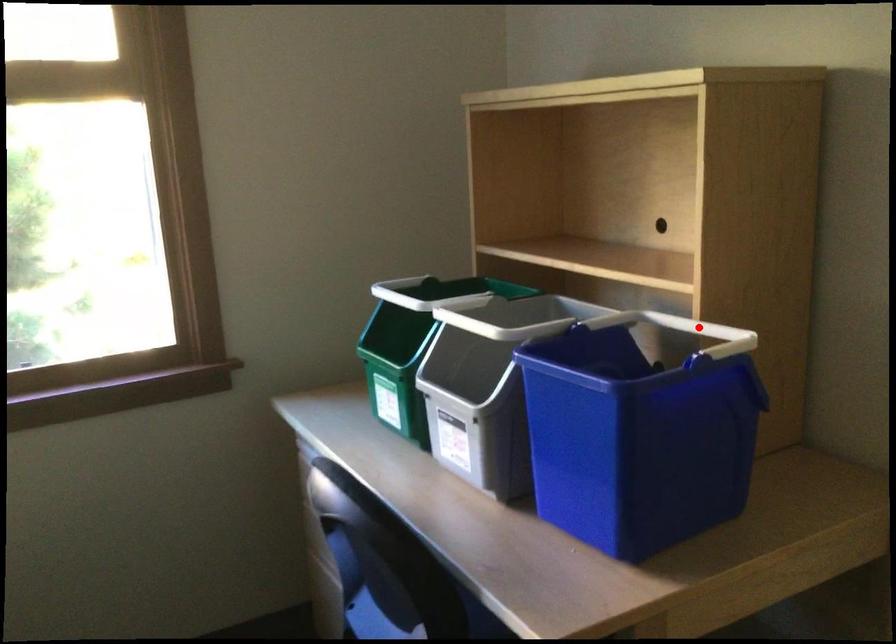
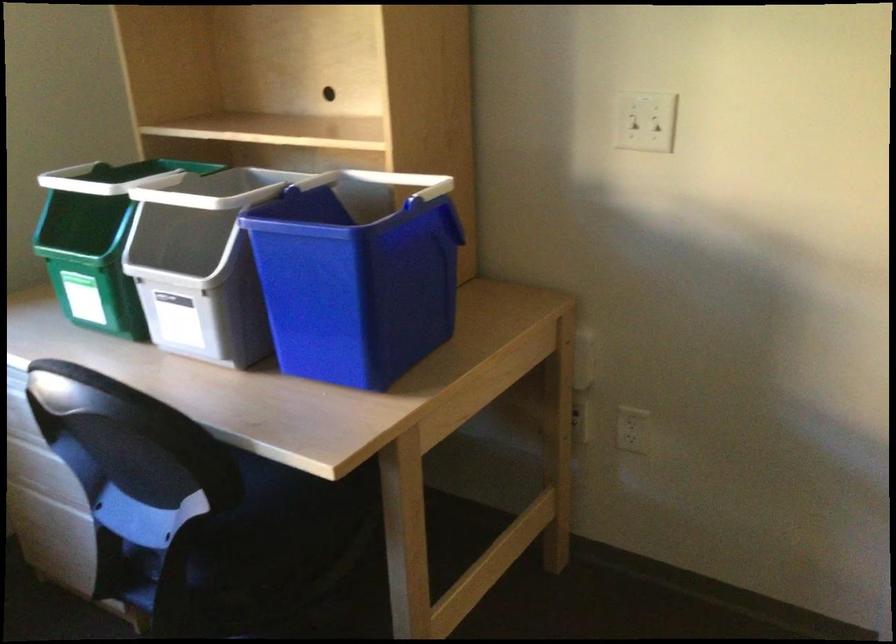
Question: I am providing you with two images of the same scene from different viewpoints. A red point is shown in image1. For the corresponding object point in image2, is it positioned nearer or farther from the camera?

Choices:
 (A) Nearer
 (B) Farther

Answer: (B)